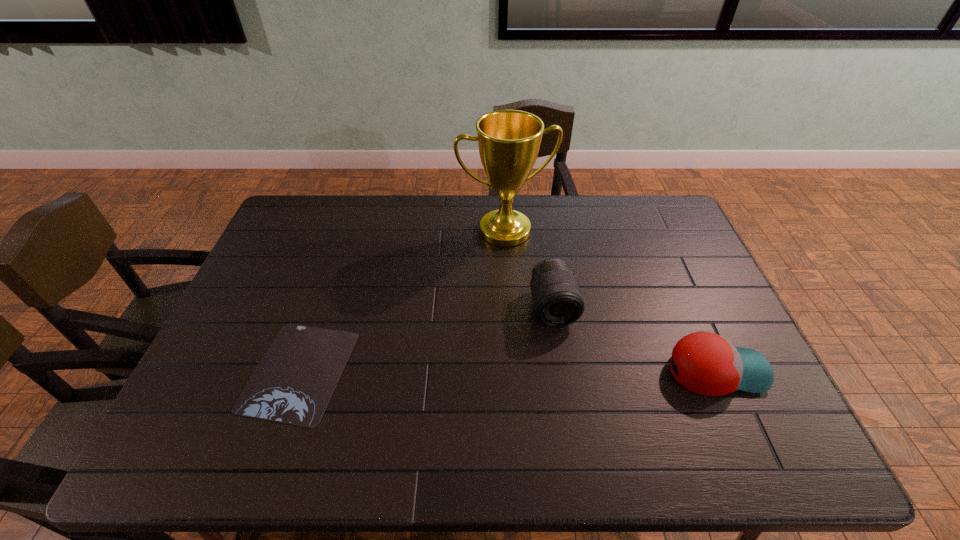
Where is `the leftmost object`? The image size is (960, 540). the leftmost object is located at coordinates (294, 382).

The width and height of the screenshot is (960, 540). In order to click on mousepad in this screenshot , I will do `click(294, 382)`.

You are a GUI agent. You are given a task and a screenshot of the screen. Output one action in this format:
    pyautogui.click(x=<x>, y=<y>)
    Task: Click on the rightmost object
    This screenshot has height=540, width=960.
    Given the screenshot: What is the action you would take?
    pyautogui.click(x=708, y=364)

Where is `the third tallest object`? Image resolution: width=960 pixels, height=540 pixels. the third tallest object is located at coordinates (708, 364).

You are a GUI agent. You are given a task and a screenshot of the screen. Output one action in this format:
    pyautogui.click(x=<x>, y=<y>)
    Task: Click on the telephoto lens
    
    Given the screenshot: What is the action you would take?
    pyautogui.click(x=557, y=301)

At what (x,y) coordinates should I click in order to perform the action: click on the tallest object. Please return your answer as a coordinate pair (x, y). Looking at the image, I should click on (508, 140).

What are the coordinates of `the farthest object` in the screenshot? It's located at (508, 140).

Locate an element on the screen. Image resolution: width=960 pixels, height=540 pixels. free region located on the back of the shortest object is located at coordinates point(328,286).

This screenshot has width=960, height=540. Identify the location of free space located 0.180m on the surface of the telephoto lens. [570, 388].

At what (x,y) coordinates should I click in order to perform the action: click on vacant area situated on the surface of the telephoto lens. Please return your answer as a coordinate pair (x, y). Looking at the image, I should click on (572, 395).